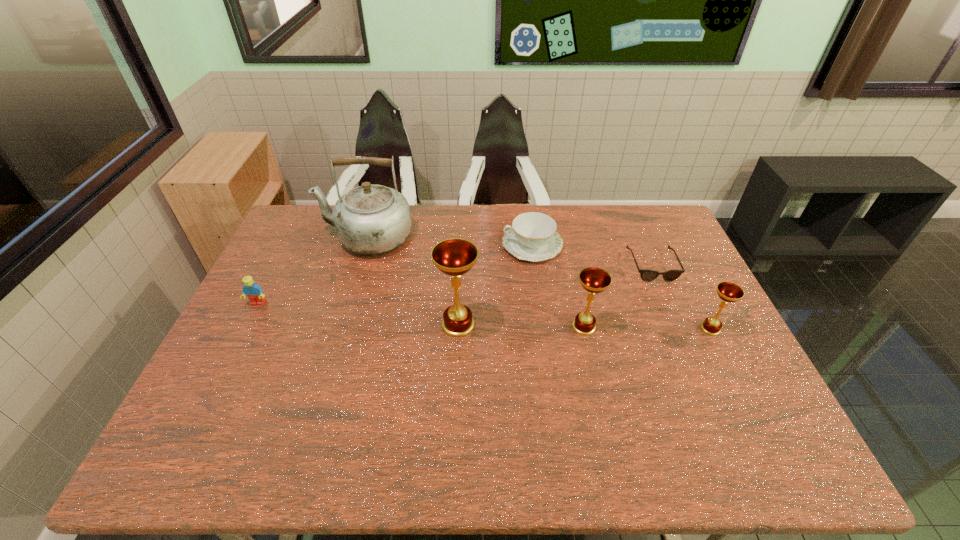
This screenshot has width=960, height=540. Identify the location of empty space between the Lego and the fourth shortest object. (484, 316).

At what (x,y) coordinates should I click in order to perform the action: click on free space between the tallest chalice and the second object from left to right. Please return your answer as a coordinate pair (x, y). Looking at the image, I should click on (x=413, y=281).

What are the coordinates of `object that is the fifth closest one to the sixth object from right to left` in the screenshot? It's located at [646, 275].

Identify which object is the third closest to the shortest chalice. Please provide its 2D coordinates. Your answer should be formatted as a tuple, i.e. [(x, y)], where the tuple contains the x and y coordinates of a point satisfying the conditions above.

[(533, 236)]

In order to click on the second closest chalice to the rightmost chalice in this screenshot , I will do `click(454, 257)`.

Locate an element on the screen. This screenshot has height=540, width=960. the closest chalice to the fifth object from right to left is located at coordinates (594, 280).

The height and width of the screenshot is (540, 960). What are the coordinates of `free space that satisfies the following two spatial constraints: 1. on the back side of the second tallest chalice; 2. on the handle side of the sixth tallest object` in the screenshot? It's located at (565, 245).

The width and height of the screenshot is (960, 540). Find the location of `vacant region that satisfies the following two spatial constraints: 1. on the handle side of the chinaware; 2. on the back side of the second chalice from left to right`. vacant region that satisfies the following two spatial constraints: 1. on the handle side of the chinaware; 2. on the back side of the second chalice from left to right is located at coordinates (543, 327).

The width and height of the screenshot is (960, 540). In order to click on vacant area that satisfies the following two spatial constraints: 1. on the handle side of the chinaware; 2. on the left side of the fourth shortest object in this screenshot , I will do [x=543, y=328].

The width and height of the screenshot is (960, 540). I want to click on blank area in the image that satisfies the following two spatial constraints: 1. on the face of the second chalice from right to left; 2. on the right side of the fifth tallest object, so click(x=246, y=327).